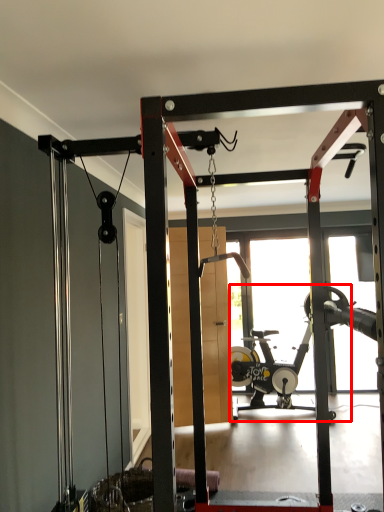
Question: From the image's perspective, what is the correct spatial relationship of stationary bicycle (annotated by the red box) in relation to garage door?

Choices:
 (A) above
 (B) below

Answer: (B)